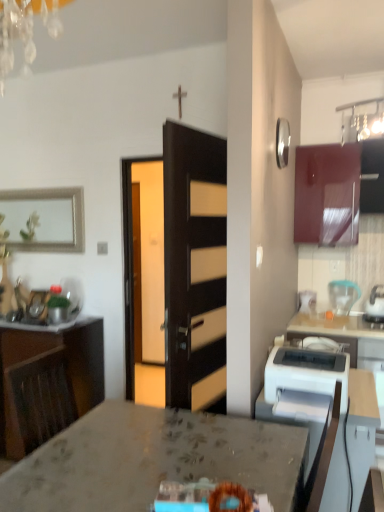
Question: In terms of size, does marble countertop at center appear bigger or smaller than silver metallic picture frame at upper left?

Choices:
 (A) small
 (B) big

Answer: (B)

Question: In the image, is marble countertop at center on the left side or the right side of silver metallic picture frame at upper left?

Choices:
 (A) right
 (B) left

Answer: (A)

Question: Considering the real-world distances, which object is farthest from the white plastic printer at right?

Choices:
 (A) glossy wood cabinet at upper right, which is the first cabinetry in top-to-bottom order
 (B) dark wood door at center
 (C) white glossy kettle at upper right, acting as the first kitchen appliance starting from the front
 (D) wooden cabinet at left, placed as the second cabinetry when sorted from right to left
 (E) silver metallic picture frame at upper left

Answer: (E)

Question: Which is farther from the marble countertop at center?

Choices:
 (A) white glossy kettle at upper right, the second kitchen appliance from the back
 (B) wooden cabinet at left, which is the second cabinetry in top-to-bottom order
 (C) white glossy table at lower right
 (D) translucent plastic blender at right, marked as the 1th kitchen appliance in a back-to-front arrangement
 (E) glossy wood cabinet at upper right, acting as the 2th cabinetry starting from the bottom

Answer: (D)